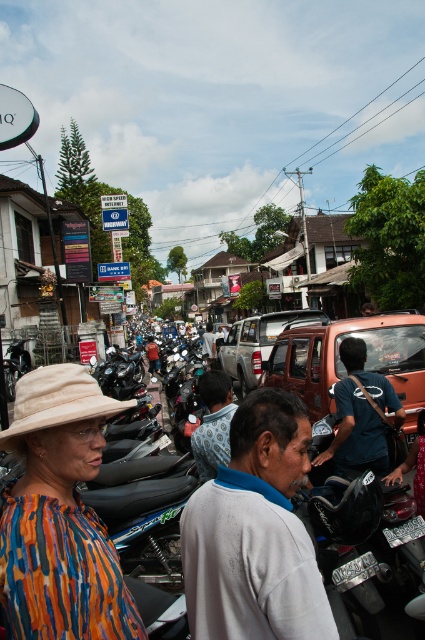
Question: Which of the following is the farthest from the observer?

Choices:
 (A) (422, 392)
 (B) (231, 339)
 (C) (221, 390)
 (D) (152, 356)

Answer: (D)

Question: Which point appears closest to the camera in this image?

Choices:
 (A) (405, 424)
 (B) (34, 570)
 (C) (308, 570)

Answer: (B)

Question: Which point is closer to the camera?

Choices:
 (A) (394, 406)
 (B) (87, 464)
 (C) (209, 531)
 (D) (149, 342)

Answer: (B)

Question: Is multicolored striped shirt at center smaller than blue denim shirt at center?

Choices:
 (A) yes
 (B) no

Answer: (A)

Question: From the image, what is the correct spatial relationship of blue fabric shirt at center in relation to patterned fabric shirt at center?

Choices:
 (A) above
 (B) below

Answer: (A)

Question: Can you confirm if multicolored striped shirt at center is wider than rustic metallic pickup truck at center?

Choices:
 (A) yes
 (B) no

Answer: (B)